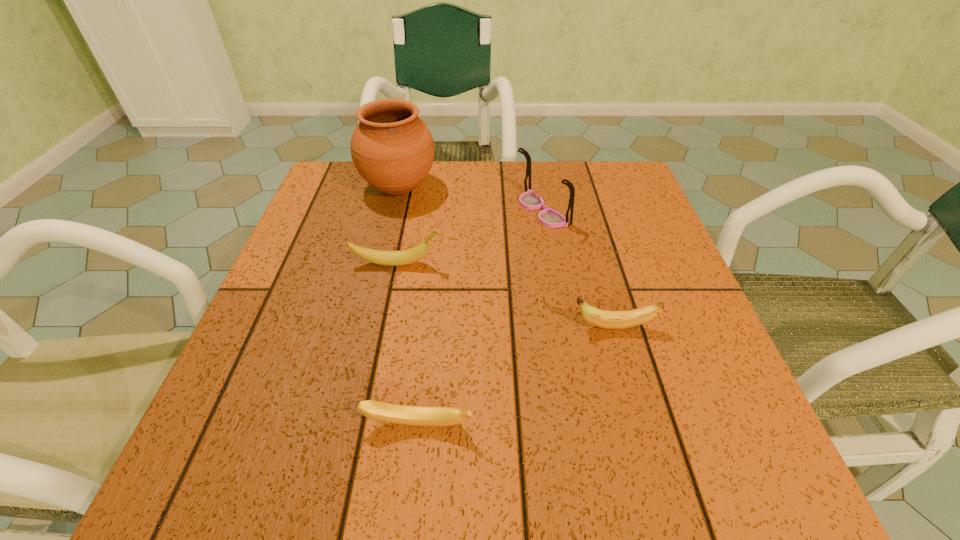
At what (x,y) coordinates should I click in order to perform the action: click on free space located at the stem of the second shortest banana. Please return your answer as a coordinate pair (x, y). The width and height of the screenshot is (960, 540). Looking at the image, I should click on (348, 327).

Image resolution: width=960 pixels, height=540 pixels. I want to click on vacant space situated at the stem of the second shortest banana, so click(353, 327).

The height and width of the screenshot is (540, 960). Find the location of `free region located 0.070m at the stem of the second shortest banana`. free region located 0.070m at the stem of the second shortest banana is located at coordinates (530, 327).

You are a GUI agent. You are given a task and a screenshot of the screen. Output one action in this format:
    pyautogui.click(x=<x>, y=<y>)
    Task: Click on the free space located 0.060m at the stem of the shortest object
    This screenshot has height=540, width=960.
    Given the screenshot: What is the action you would take?
    pyautogui.click(x=412, y=480)

Where is `pottery that is positioned at the far edge`? pottery that is positioned at the far edge is located at coordinates (392, 149).

I want to click on spectacles located at the far edge, so 548,217.

What are the coordinates of `object located in the near edge section of the desktop` in the screenshot? It's located at (400, 414).

What are the coordinates of `pottery at the left edge` in the screenshot? It's located at (392, 149).

The image size is (960, 540). I want to click on banana at the left edge, so click(x=402, y=257).

Find the location of a particular element. object that is at the right edge is located at coordinates (604, 319).